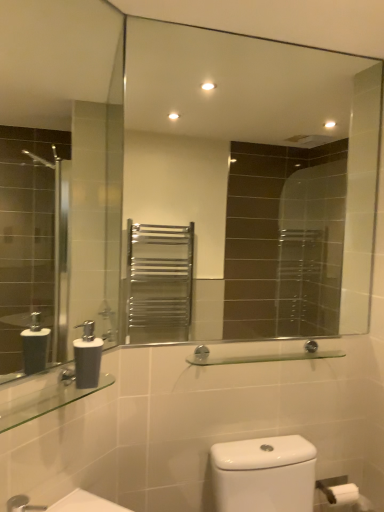
Describe the element at coordinates (45, 402) in the screenshot. This screenshot has width=384, height=512. I see `clear glass shelf at lower left, which is counted as the 2th balustrade, starting from the right` at that location.

How much space does clear glass shelf at lower left, arranged as the 1th balustrade when viewed from the front, occupy vertically?

The height of clear glass shelf at lower left, arranged as the 1th balustrade when viewed from the front, is 1.78 inches.

This screenshot has width=384, height=512. What do you see at coordinates (87, 357) in the screenshot? I see `matte gray soap dispenser at lower left` at bounding box center [87, 357].

Identify the location of clear glass shelf at lower left, which is counted as the 2th balustrade, starting from the right. (45, 402).

Which is correct: clear glass shelf at center, the first balustrade viewed from the back, is inside clear glass shelf at lower left, arranged as the 1th balustrade when viewed from the front, or outside of it?

clear glass shelf at center, the first balustrade viewed from the back, cannot be found inside clear glass shelf at lower left, arranged as the 1th balustrade when viewed from the front.

In order to click on balustrade below the clear glass shelf at center, the first balustrade viewed from the back (from the image's perspective) in this screenshot , I will do `click(45, 402)`.

Considering the relative sizes of clear glass shelf at center, which ranks as the 2th balustrade in front-to-back order, and clear glass shelf at lower left, marked as the 2th balustrade in a back-to-front arrangement, in the image provided, is clear glass shelf at center, which ranks as the 2th balustrade in front-to-back order, wider than clear glass shelf at lower left, marked as the 2th balustrade in a back-to-front arrangement,?

Incorrect, the width of clear glass shelf at center, which ranks as the 2th balustrade in front-to-back order, does not surpass that of clear glass shelf at lower left, marked as the 2th balustrade in a back-to-front arrangement.

Which is more distant, (82,381) or (195,351)?

The point (195,351) is behind.

From a real-world perspective, who is located higher, matte gray soap dispenser at lower left or clear glass shelf at center, placed as the second balustrade when sorted from left to right?

matte gray soap dispenser at lower left.

Is matte gray soap dispenser at lower left shorter than clear glass shelf at center, arranged as the 1th balustrade when viewed from the right?

Incorrect, the height of matte gray soap dispenser at lower left does not fall short of that of clear glass shelf at center, arranged as the 1th balustrade when viewed from the right.

Locate an element on the screen. soap dispenser lying in front of the clear glass shelf at center, which ranks as the 2th balustrade in front-to-back order is located at coordinates (87, 357).

Considering the positions of point (4, 426) and point (252, 359), is point (4, 426) closer or farther from the camera than point (252, 359)?

Point (4, 426) is closer to the camera than point (252, 359).

From a real-world perspective, which object rests below the other?

clear glass shelf at lower left, the 1th balustrade in the left-to-right sequence, from a real-world perspective.

Is the depth of clear glass shelf at lower left, marked as the 2th balustrade in a back-to-front arrangement, greater than that of clear glass shelf at center, arranged as the 1th balustrade when viewed from the right?

No, it is not.

You are a GUI agent. You are given a task and a screenshot of the screen. Output one action in this format:
    pyautogui.click(x=<x>, y=<y>)
    Task: Click on the balustrade to the right of clear glass shelf at lower left, which is counted as the 2th balustrade, starting from the right
    The width and height of the screenshot is (384, 512).
    Given the screenshot: What is the action you would take?
    pyautogui.click(x=261, y=356)

From the image's perspective, is matte gray soap dispenser at lower left located above or below clear glass shelf at lower left, the 1th balustrade in the left-to-right sequence?

From the image's perspective, matte gray soap dispenser at lower left appears above clear glass shelf at lower left, the 1th balustrade in the left-to-right sequence.

Considering the sizes of objects matte gray soap dispenser at lower left and clear glass shelf at lower left, marked as the 2th balustrade in a back-to-front arrangement, in the image provided, who is bigger, matte gray soap dispenser at lower left or clear glass shelf at lower left, marked as the 2th balustrade in a back-to-front arrangement,?

Bigger between the two is clear glass shelf at lower left, marked as the 2th balustrade in a back-to-front arrangement.

Is matte gray soap dispenser at lower left positioned far away from clear glass shelf at lower left, which is counted as the 2th balustrade, starting from the right?

No, matte gray soap dispenser at lower left is not far away from clear glass shelf at lower left, which is counted as the 2th balustrade, starting from the right.

Based on the photo, from their relative heights in the image, would you say matte gray soap dispenser at lower left is taller or shorter than clear glass shelf at lower left, the 1th balustrade in the left-to-right sequence?

In the image, matte gray soap dispenser at lower left appears to be taller than clear glass shelf at lower left, the 1th balustrade in the left-to-right sequence.

Is clear glass shelf at lower left, marked as the 2th balustrade in a back-to-front arrangement, wider or thinner than matte gray soap dispenser at lower left?

Considering their sizes, clear glass shelf at lower left, marked as the 2th balustrade in a back-to-front arrangement, looks broader than matte gray soap dispenser at lower left.

From the image's perspective, which is below, clear glass shelf at lower left, arranged as the 1th balustrade when viewed from the front, or matte gray soap dispenser at lower left?

clear glass shelf at lower left, arranged as the 1th balustrade when viewed from the front.

From a real-world perspective, is clear glass shelf at lower left, which is counted as the 2th balustrade, starting from the right, physically located above or below matte gray soap dispenser at lower left?

In terms of real-world spatial position, clear glass shelf at lower left, which is counted as the 2th balustrade, starting from the right, is below matte gray soap dispenser at lower left.

Is matte gray soap dispenser at lower left at the back of clear glass shelf at lower left, marked as the 2th balustrade in a back-to-front arrangement?

No.

Considering the positions of objects clear glass shelf at center, the first balustrade viewed from the back, and matte gray soap dispenser at lower left in the image provided, who is more to the right, clear glass shelf at center, the first balustrade viewed from the back, or matte gray soap dispenser at lower left?

clear glass shelf at center, the first balustrade viewed from the back.

From a real-world perspective, which object stands above the other?

matte gray soap dispenser at lower left.

From the image's perspective, which one is positioned lower, clear glass shelf at center, placed as the second balustrade when sorted from left to right, or matte gray soap dispenser at lower left?

clear glass shelf at center, placed as the second balustrade when sorted from left to right, from the image's perspective.

In the scene shown: Is clear glass shelf at center, the first balustrade viewed from the back, facing away from matte gray soap dispenser at lower left?

No.

The width and height of the screenshot is (384, 512). Find the location of `balustrade that is on the right side of clear glass shelf at lower left, the 1th balustrade in the left-to-right sequence`. balustrade that is on the right side of clear glass shelf at lower left, the 1th balustrade in the left-to-right sequence is located at coordinates (261, 356).

Where is `balustrade that is behind the matte gray soap dispenser at lower left`? This screenshot has height=512, width=384. balustrade that is behind the matte gray soap dispenser at lower left is located at coordinates (261, 356).

Consider the image. Considering their positions, is matte gray soap dispenser at lower left positioned further to clear glass shelf at center, arranged as the 1th balustrade when viewed from the right, than clear glass shelf at lower left, arranged as the 1th balustrade when viewed from the front?

The object further to clear glass shelf at center, arranged as the 1th balustrade when viewed from the right, is matte gray soap dispenser at lower left.

Looking at the image, which one is located closer to matte gray soap dispenser at lower left, clear glass shelf at lower left, which is counted as the 2th balustrade, starting from the right, or clear glass shelf at center, the first balustrade viewed from the back?

clear glass shelf at lower left, which is counted as the 2th balustrade, starting from the right, lies closer to matte gray soap dispenser at lower left than the other object.

Which object lies further to the anchor point clear glass shelf at center, which ranks as the 2th balustrade in front-to-back order, clear glass shelf at lower left, marked as the 2th balustrade in a back-to-front arrangement, or matte gray soap dispenser at lower left?

The object further to clear glass shelf at center, which ranks as the 2th balustrade in front-to-back order, is matte gray soap dispenser at lower left.

Based on their spatial positions, is clear glass shelf at center, the first balustrade viewed from the back, or matte gray soap dispenser at lower left further from clear glass shelf at lower left, which is counted as the 2th balustrade, starting from the right?

Among the two, clear glass shelf at center, the first balustrade viewed from the back, is located further to clear glass shelf at lower left, which is counted as the 2th balustrade, starting from the right.

Which object lies nearer to the anchor point clear glass shelf at lower left, marked as the 2th balustrade in a back-to-front arrangement, matte gray soap dispenser at lower left or clear glass shelf at center, the first balustrade viewed from the back?

Based on the image, matte gray soap dispenser at lower left appears to be nearer to clear glass shelf at lower left, marked as the 2th balustrade in a back-to-front arrangement.

Looking at the image, which one is located closer to matte gray soap dispenser at lower left, clear glass shelf at center, which ranks as the 2th balustrade in front-to-back order, or clear glass shelf at lower left, arranged as the 1th balustrade when viewed from the front?

clear glass shelf at lower left, arranged as the 1th balustrade when viewed from the front.

In order to click on soap dispenser situated between clear glass shelf at lower left, marked as the 2th balustrade in a back-to-front arrangement, and clear glass shelf at center, which ranks as the 2th balustrade in front-to-back order, from left to right in this screenshot , I will do `click(87, 357)`.